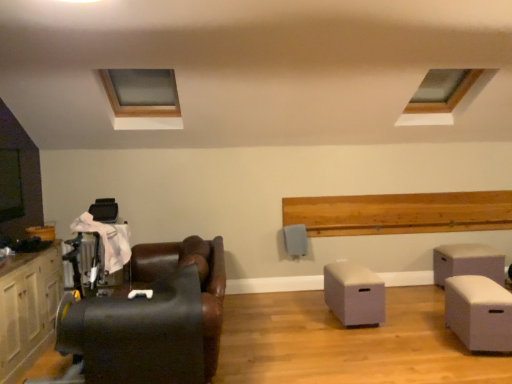
Question: Is beige fabric ottoman at right, which is counted as the third table, starting from the left, to the left or to the right of white matte storage box at center, acting as the 2th table starting from the back, in the image?

Choices:
 (A) right
 (B) left

Answer: (A)

Question: Considering the positions of point (449, 274) and point (356, 296), is point (449, 274) closer or farther from the camera than point (356, 296)?

Choices:
 (A) farther
 (B) closer

Answer: (A)

Question: Which is farther from the beige fabric ottoman at right, which ranks as the 1th table in back-to-front order?

Choices:
 (A) black leather chair at left
 (B) wooden frame at upper left
 (C) white matte storage box at center, marked as the first table in a left-to-right arrangement
 (D) white matte storage box at lower right, which appears as the 2th table when viewed from the right
 (E) transparent glass window at upper right

Answer: (B)

Question: Which is farther from the white matte storage box at center, arranged as the third table when viewed from the right?

Choices:
 (A) transparent glass window at upper right
 (B) beige fabric ottoman at right, which ranks as the 1th table in back-to-front order
 (C) black leather chair at left
 (D) matte white cabinet at left
 (E) white matte storage box at lower right, which appears as the third table when viewed from the back

Answer: (D)